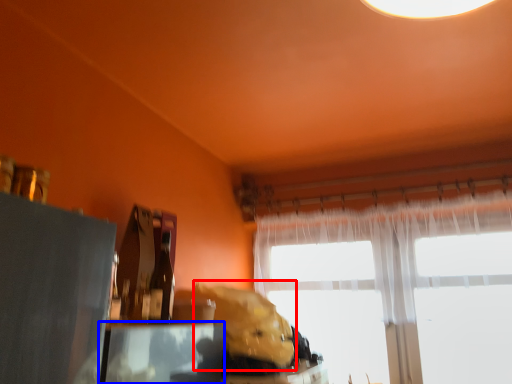
Question: Which point is closer to the camera, animal (highlighted by a red box) or table (highlighted by a blue box)?

Choices:
 (A) animal
 (B) table

Answer: (B)